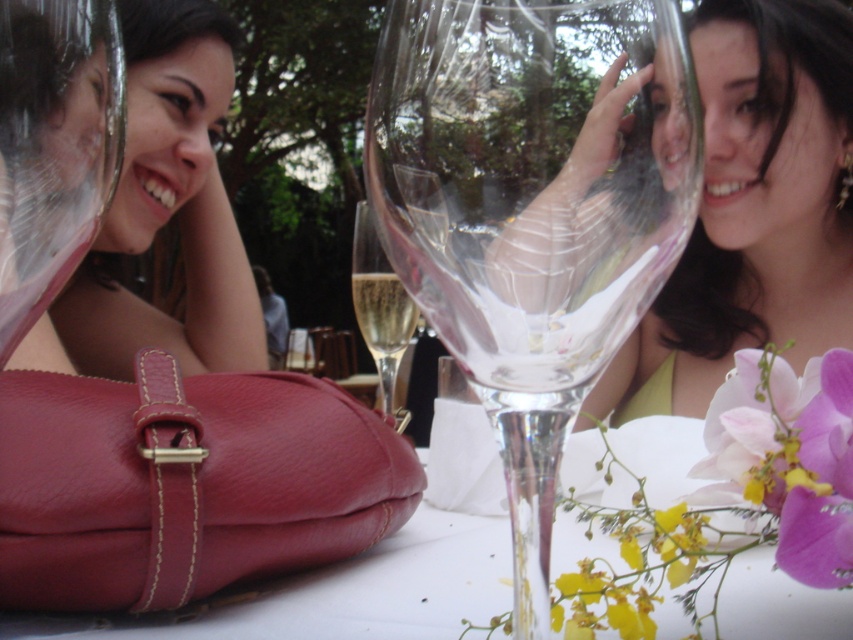
Question: Can you confirm if leather handbag at center is bigger than clear glass wine glass at center?

Choices:
 (A) yes
 (B) no

Answer: (A)

Question: From the image, what is the correct spatial relationship of matte gold necklace at upper center in relation to leather handbag at center?

Choices:
 (A) right
 (B) left

Answer: (A)

Question: Does transparent glass wine glass at center appear over matte gold necklace at upper center?

Choices:
 (A) no
 (B) yes

Answer: (A)

Question: Among these points, which one is farthest from the camera?

Choices:
 (A) click(610, 234)
 (B) click(842, 266)
 (C) click(384, 362)

Answer: (B)

Question: Which object is the closest to the leather handbag at center?

Choices:
 (A) transparent glass wine glass at center
 (B) matte gold necklace at upper center
 (C) clear glass wine glass at center
 (D) pink silk flower at lower right

Answer: (D)

Question: Which point is closer to the camera?

Choices:
 (A) translucent glass champagne flute at center
 (B) leather handbag at center
 (C) clear glass wine glass at center

Answer: (B)